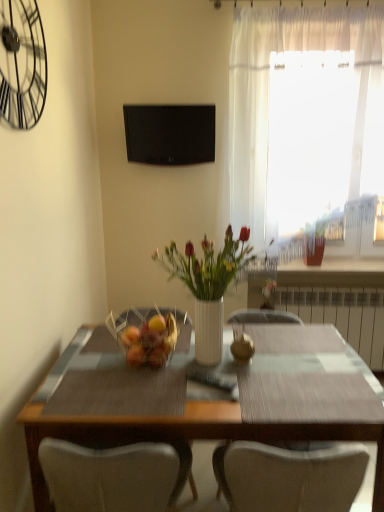
Measure the distance between translucent fabric curtain at upper right and camera.

A distance of 7.48 feet exists between translucent fabric curtain at upper right and camera.

What do you see at coordinates (208, 285) in the screenshot? The image size is (384, 512). I see `white glossy vase at center` at bounding box center [208, 285].

Locate an element on the screen. The height and width of the screenshot is (512, 384). black metal clock at upper left is located at coordinates [x=22, y=64].

What do you see at coordinates (170, 134) in the screenshot? I see `black matte television at upper center` at bounding box center [170, 134].

Where is `white metallic radiator at right`? white metallic radiator at right is located at coordinates (342, 315).

Where is `translucent fabric curtain at upper right`? The image size is (384, 512). translucent fabric curtain at upper right is located at coordinates (303, 118).

Based on the photo, which object is positioned more to the right, black matte television at upper center or translucent glass basket at center?

black matte television at upper center is more to the right.

From a real-world perspective, is black matte television at upper center positioned over translucent glass basket at center based on gravity?

Indeed, from a real-world perspective, black matte television at upper center stands above translucent glass basket at center.

Is black matte television at upper center looking in the opposite direction of translucent glass basket at center?

black matte television at upper center does not have its back to translucent glass basket at center.

Which point is more forward, (163, 141) or (143, 351)?

The point (143, 351) is more forward.

Can you see translucent fabric curtain at upper right touching white metallic radiator at right?

No, translucent fabric curtain at upper right is not touching white metallic radiator at right.

Is translucent fabric curtain at upper right positioned with its back to white metallic radiator at right?

No, translucent fabric curtain at upper right is not facing away from white metallic radiator at right.

Where is `curtain in front of the white metallic radiator at right`? curtain in front of the white metallic radiator at right is located at coordinates (303, 118).

Between yellow matte apple at center and black metal clock at upper left, which one has smaller size?

yellow matte apple at center is smaller.

Which is closer, (152, 325) or (8, 53)?

Point (152, 325) appears to be farther away from the viewer than point (8, 53).

How far apart are yellow matte apple at center and black metal clock at upper left?

yellow matte apple at center is 1.08 meters away from black metal clock at upper left.

Is yellow matte apple at center positioned beyond the bounds of black metal clock at upper left?

Absolutely, yellow matte apple at center is external to black metal clock at upper left.

Can you tell me how much black metal clock at upper left and translucent fabric curtain at upper right differ in facing direction?

90.6 degrees.

Is black metal clock at upper left inside the boundaries of translucent fabric curtain at upper right, or outside?

The correct answer is: outside.

From the image's perspective, is black metal clock at upper left below translucent fabric curtain at upper right?

Actually, black metal clock at upper left appears above translucent fabric curtain at upper right in the image.

Does point (19, 92) come behind point (314, 206)?

No, it is in front of (314, 206).

Can you confirm if translucent glass basket at center is positioned to the left of black metal clock at upper left?

No, translucent glass basket at center is not to the left of black metal clock at upper left.

Which is nearer, [146,335] or [26,119]?

The point [26,119] is closer to the camera.

Could you tell me if wooden table at center is turned towards yellow matte apple at center?

No, wooden table at center is not aimed at yellow matte apple at center.

Is point (328, 326) in front of point (161, 331)?

No, (328, 326) is further to viewer.

In the scene shown: Between wooden table at center and yellow matte apple at center, which one has smaller width?

With smaller width is yellow matte apple at center.

Is wooden table at center surrounding yellow matte apple at center?

No.

Is translucent glass basket at center to the left of white metallic radiator at right from the viewer's perspective?

Correct, you'll find translucent glass basket at center to the left of white metallic radiator at right.

Based on the photo, does translucent glass basket at center lie in front of white metallic radiator at right?

Yes, translucent glass basket at center is closer to the camera.

Can you confirm if translucent glass basket at center is thinner than white metallic radiator at right?

Incorrect, the width of translucent glass basket at center is not less than that of white metallic radiator at right.

The image size is (384, 512). I want to click on fruit dish lying on the left of white metallic radiator at right, so (x=151, y=341).

The height and width of the screenshot is (512, 384). In order to click on fruit dish on the left of black matte television at upper center in this screenshot , I will do `click(151, 341)`.

Locate an element on the screen. The width and height of the screenshot is (384, 512). radiator below the translucent fabric curtain at upper right (from the image's perspective) is located at coordinates (342, 315).

Considering their positions, is black matte television at upper center positioned further to wooden table at center than black metal clock at upper left?

The object further to wooden table at center is black matte television at upper center.

From the image, which object appears to be nearer to translucent glass basket at center, wooden table at center or white metallic radiator at right?

Among the two, wooden table at center is located nearer to translucent glass basket at center.

Based on their spatial positions, is white metallic radiator at right or translucent glass basket at center closer to wooden table at center?

translucent glass basket at center lies closer to wooden table at center than the other object.

When comparing their distances from white glossy vase at center, does white metallic radiator at right or black metal clock at upper left seem closer?

black metal clock at upper left is closer to white glossy vase at center.

Looking at the image, which one is located further to yellow matte apple at center, black matte television at upper center or wooden table at center?

black matte television at upper center.

Which object lies nearer to the anchor point white glossy vase at center, wooden table at center or translucent glass basket at center?

translucent glass basket at center is closer to white glossy vase at center.

From the image, which object appears to be nearer to wooden table at center, white glossy vase at center or black metal clock at upper left?

Among the two, white glossy vase at center is located nearer to wooden table at center.

Estimate the real-world distances between objects in this image. Which object is closer to black metal clock at upper left, white glossy vase at center or yellow matte apple at center?

Among the two, white glossy vase at center is located nearer to black metal clock at upper left.

At what (x,y) coordinates should I click in order to perform the action: click on television located between black metal clock at upper left and translucent fabric curtain at upper right in the left-right direction. Please return your answer as a coordinate pair (x, y). This screenshot has width=384, height=512. Looking at the image, I should click on (170, 134).

The width and height of the screenshot is (384, 512). I want to click on fruit dish between translucent fabric curtain at upper right and wooden table at center vertically, so click(151, 341).

What are the coordinates of `curtain between white glossy vase at center and white metallic radiator at right along the z-axis` in the screenshot? It's located at (303, 118).

Find the location of a particular element. The width and height of the screenshot is (384, 512). fruit between wooden table at center and white metallic radiator at right along the z-axis is located at coordinates (157, 324).